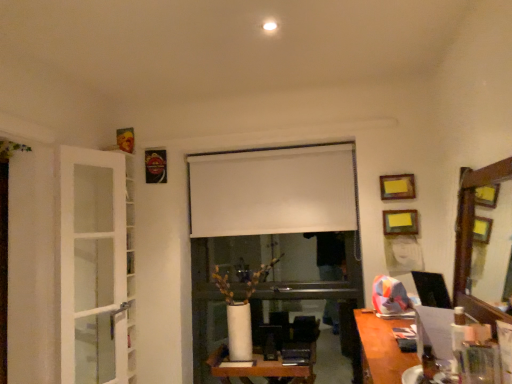
Question: Would you say wooden desk at lower right, which is the 2th table from back to front, is inside or outside yellow paper at upper right, which appears as the 3th picture frame when viewed from the left?

Choices:
 (A) outside
 (B) inside

Answer: (A)

Question: Considering the positions of wooden desk at lower right, the 1th table viewed from the top, and yellow paper at upper right, arranged as the first picture frame when ordered from the bottom, in the image, is wooden desk at lower right, the 1th table viewed from the top, taller or shorter than yellow paper at upper right, arranged as the first picture frame when ordered from the bottom,?

Choices:
 (A) tall
 (B) short

Answer: (A)

Question: Which of these objects is positioned closest to the wooden framed mirror at right?

Choices:
 (A) white glossy table at center, the 1th table viewed from the back
 (B) white glass door at left
 (C) metallic gold picture frame at upper left, the first picture frame in the back-to-front sequence
 (D) yellow paper at upper right, which is counted as the 3th picture frame, starting from the back
 (E) wooden desk at lower right, which is the 2th table from back to front

Answer: (D)

Question: Which of these objects is positioned closest to the wooden framed mirror at right?

Choices:
 (A) metallic gold picture frame at upper left, the third picture frame from the right
 (B) yellow paper at upper right, which appears as the 3th picture frame when viewed from the left
 (C) white glossy table at center, the 1th table viewed from the back
 (D) wooden desk at lower right, arranged as the 2th table when ordered from the bottom
 (E) white glass door at left

Answer: (B)